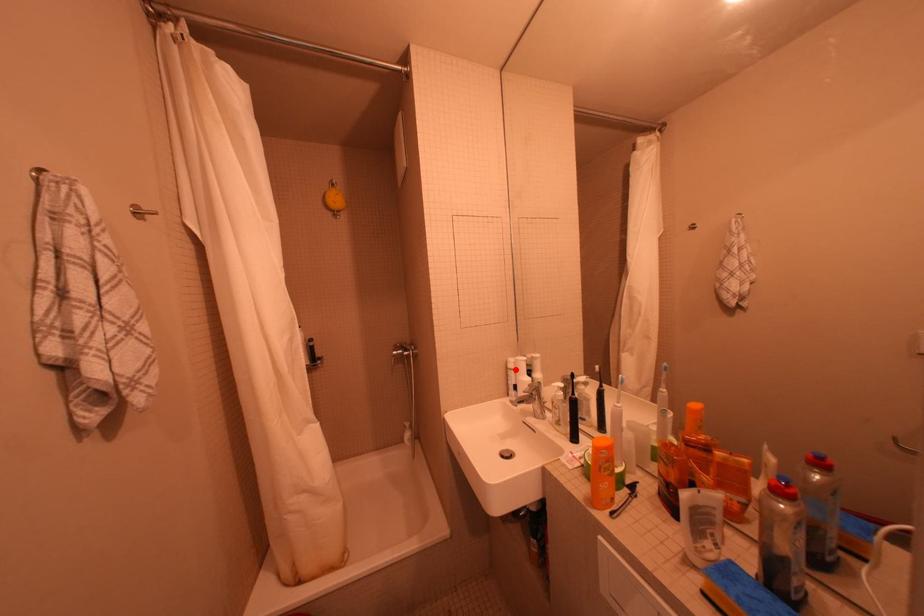
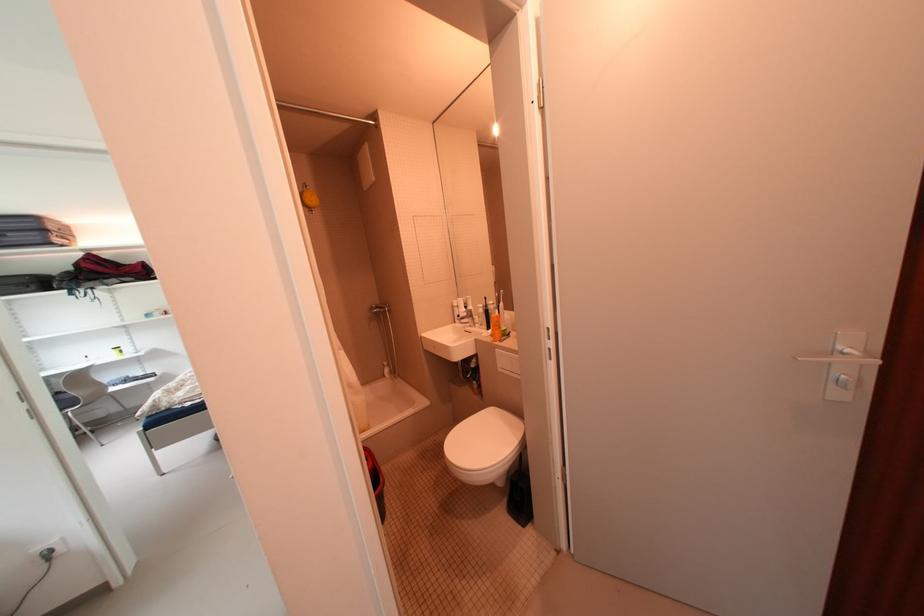
Question: I am providing you with two images of the same scene from different viewpoints. A red point is marked on the first image. Is the red point's position out of view in image 2?

Choices:
 (A) Yes
 (B) No

Answer: (B)